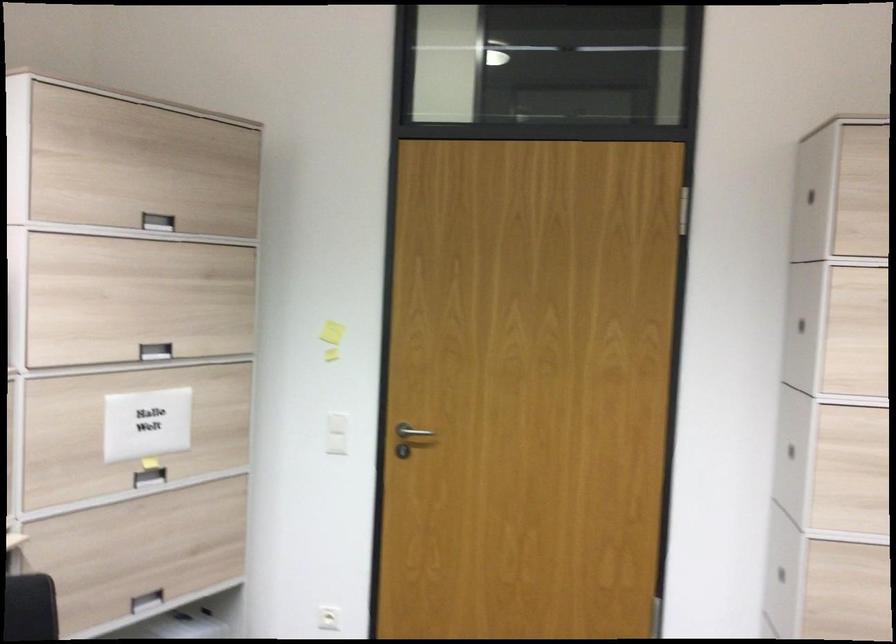
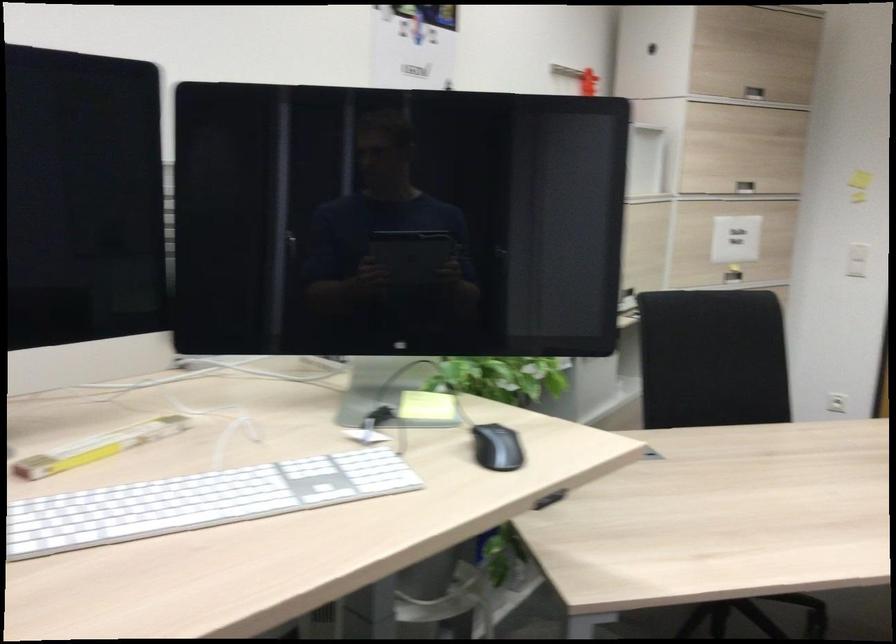
The point at (141, 227) is marked in the first image. Where is the corresponding point in the second image?

(754, 93)